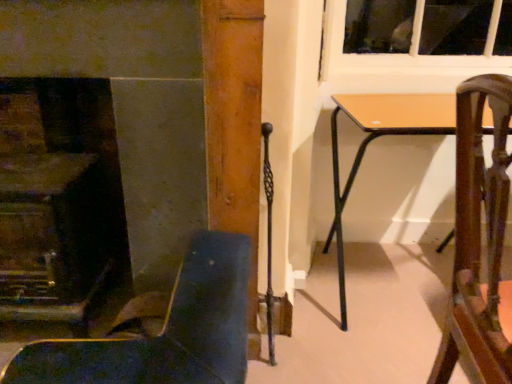
Question: From their relative heights in the image, would you say wooden chair at right, the second chair viewed from the left, is taller or shorter than leather-like dark blue chair at lower left, marked as the 1th chair in a left-to-right arrangement?

Choices:
 (A) short
 (B) tall

Answer: (B)

Question: Based on their sizes in the image, would you say wooden chair at right, the second chair viewed from the left, is bigger or smaller than leather-like dark blue chair at lower left, placed as the second chair when sorted from right to left?

Choices:
 (A) big
 (B) small

Answer: (B)

Question: Which of these objects is positioned closest to the smooth stone fireplace at left?

Choices:
 (A) light brown wooden table at center
 (B) leather-like dark blue chair at lower left, placed as the second chair when sorted from right to left
 (C) wooden chair at right, placed as the first chair when sorted from right to left

Answer: (B)

Question: Which is nearer to the smooth stone fireplace at left?

Choices:
 (A) light brown wooden table at center
 (B) wooden chair at right, the second chair viewed from the left
 (C) leather-like dark blue chair at lower left, marked as the 1th chair in a left-to-right arrangement

Answer: (C)